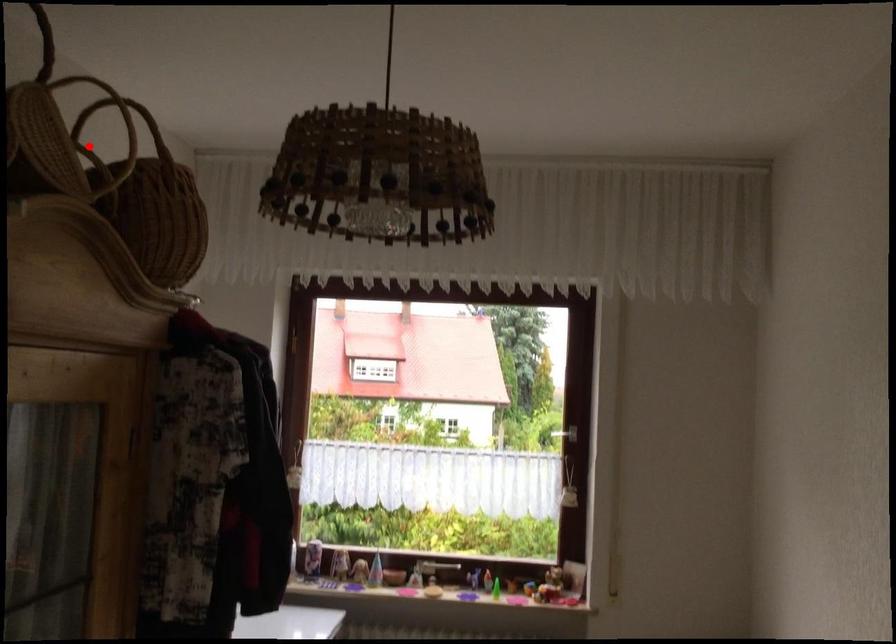
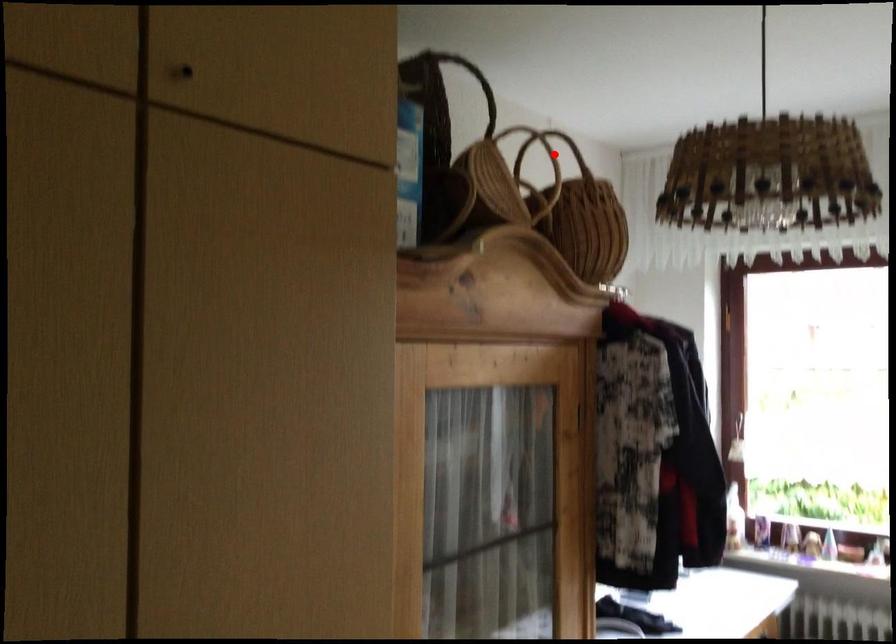
I am providing you with two images of the same scene from different viewpoints. A red point is marked on the first image and another point is marked on the second image. Is the red point in image1 aligned with the point shown in image2?

No